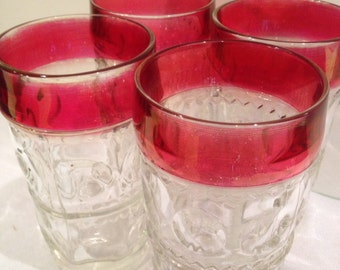
Locate an element on the screen. Image resolution: width=340 pixels, height=270 pixels. table to beside glass is located at coordinates (320, 233).